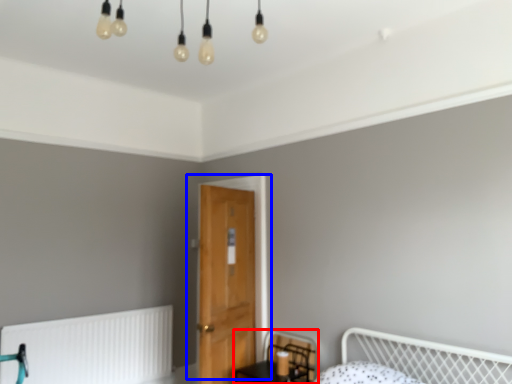
Question: Which object appears closest to the camera in this image, swivel chair (highlighted by a red box) or door (highlighted by a blue box)?

Choices:
 (A) swivel chair
 (B) door

Answer: (A)